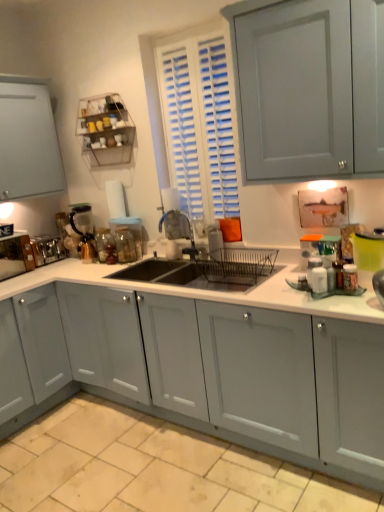
Locate an element on the screen. The image size is (384, 512). vacant space to the right of clear glass jar at sink, placed as the fourth appliance when sorted from left to right is located at coordinates (148, 268).